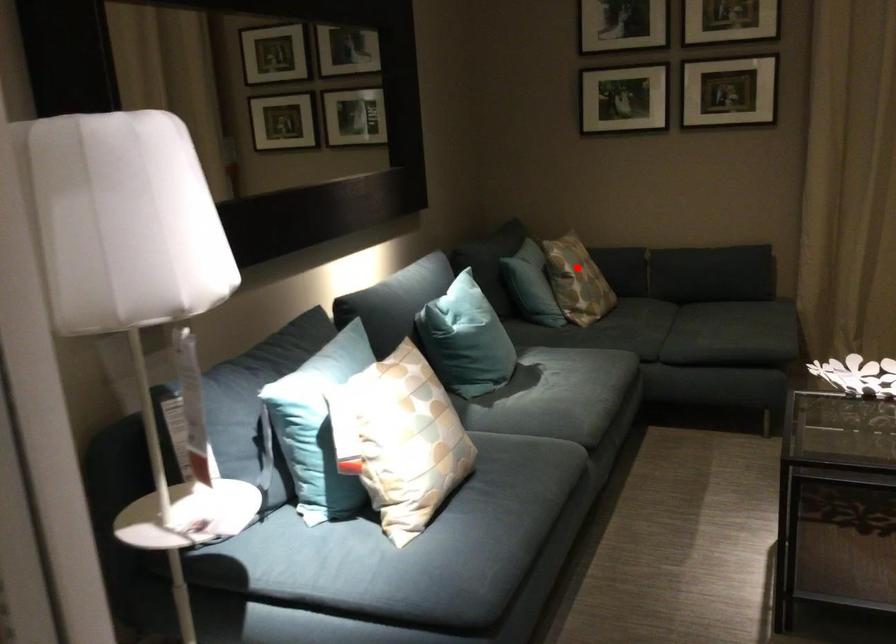
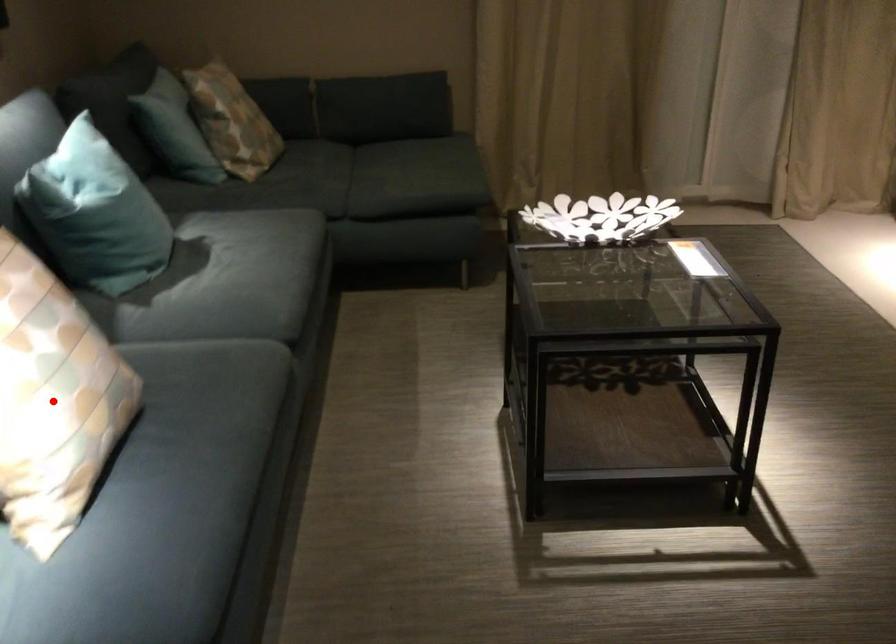
I am providing you with two images of the same scene from different viewpoints. A red point is marked on the first image and another point is marked on the second image. Does the point marked in image1 correspond to the same location as the one in image2?

No